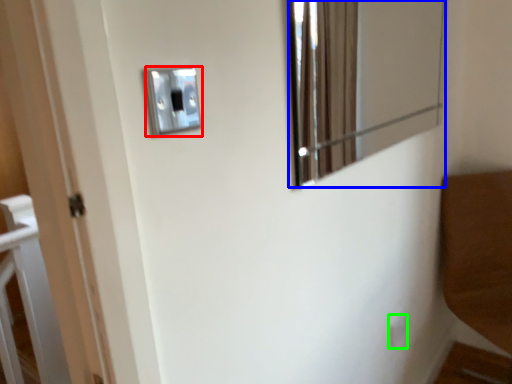
Question: Which is nearer to the light switch (highlighted by a red box)? mirror (highlighted by a blue box) or light switch (highlighted by a green box).

Choices:
 (A) mirror
 (B) light switch

Answer: (B)